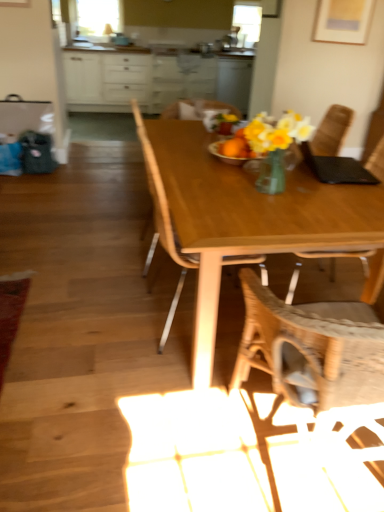
Question: Is white glossy cabinets at upper center bigger or smaller than wooden chair at center, positioned as the first chair in right-to-left order?

Choices:
 (A) big
 (B) small

Answer: (A)

Question: In terms of width, does white glossy cabinets at upper center look wider or thinner when compared to wooden chair at center, marked as the third chair in a left-to-right arrangement?

Choices:
 (A) wide
 (B) thin

Answer: (A)

Question: Which object is positioned closest to the white glossy cabinets at upper center?

Choices:
 (A) wooden chair at center, which ranks as the third chair in right-to-left order
 (B) wooden table at center
 (C) clear glass window screen at upper left
 (D) wooden chair at center, marked as the third chair in a left-to-right arrangement
 (E) woven fabric chair at center, acting as the 2th chair starting from the left

Answer: (C)

Question: Based on their relative distances, which object is nearer to the wooden chair at center, marked as the third chair in a left-to-right arrangement?

Choices:
 (A) wooden table at center
 (B) white glossy cabinets at upper center
 (C) wooden chair at center, the first chair positioned from the left
 (D) clear glass window screen at upper left
 (E) woven fabric chair at center, acting as the 2th chair starting from the left

Answer: (E)